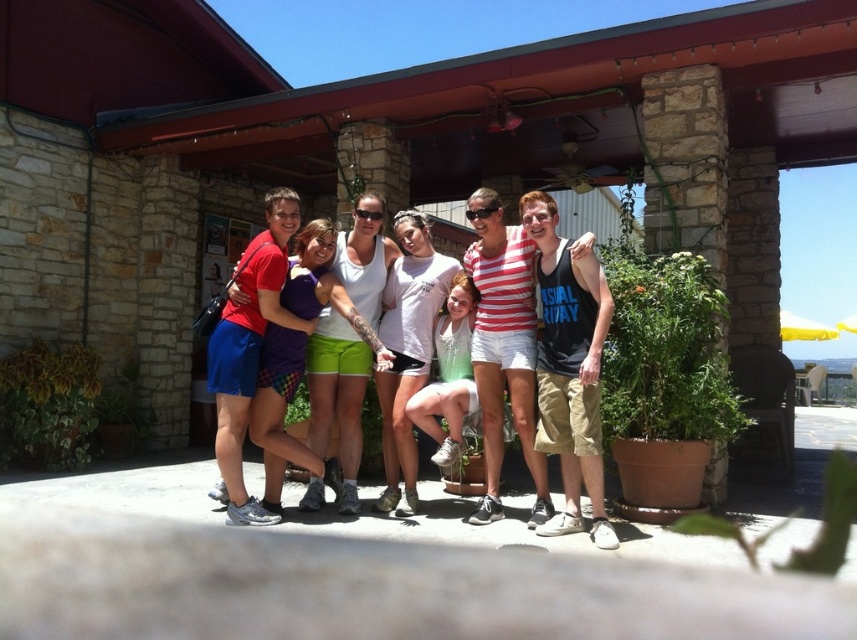
Question: Which object appears closest to the camera in this image?

Choices:
 (A) striped cotton shirt at center
 (B) white cotton t-shirt at center
 (C) white cotton shirt at center

Answer: (A)

Question: Can you confirm if striped cotton shirt at center is positioned to the right of plaid shorts at center?

Choices:
 (A) yes
 (B) no

Answer: (A)

Question: Can you confirm if plaid shorts at center is bigger than white cotton shirt at center?

Choices:
 (A) yes
 (B) no

Answer: (A)

Question: Is striped cotton shirt at center thinner than white cotton t-shirt at center?

Choices:
 (A) no
 (B) yes

Answer: (B)

Question: Among these points, which one is farthest from the camera?

Choices:
 (A) (471, 397)
 (B) (432, 285)
 (C) (333, 230)

Answer: (B)

Question: Which object is farther from the camera taking this photo?

Choices:
 (A) plaid shorts at center
 (B) white cotton t-shirt at center

Answer: (B)